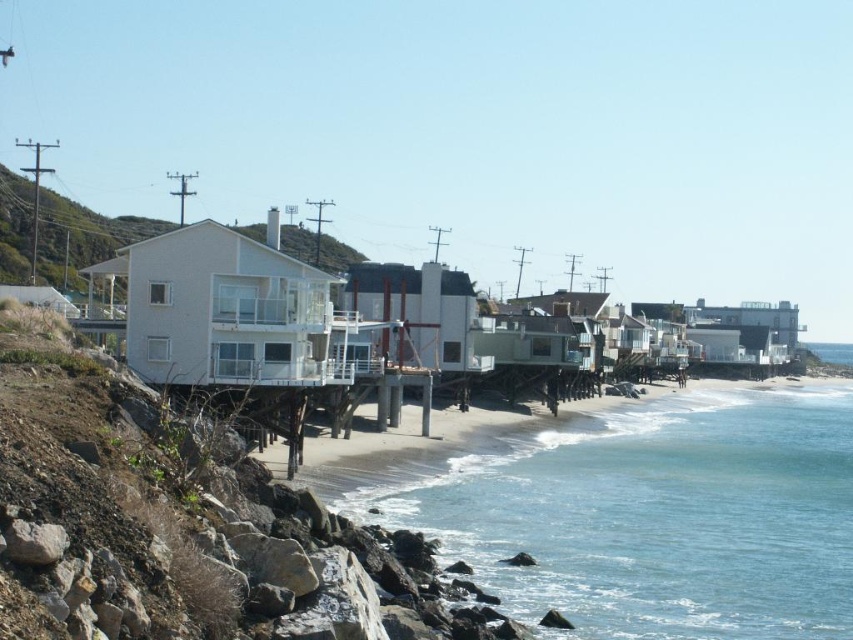
You are standing on the beach and want to take a photo of the white matte house at center without any obstructions. Is the clear blue water at lower right blocking your view of the house?

The clear blue water at lower right is in front of the white matte house at center, so it may block your view of the house depending on your position. To avoid obstruction, move to a higher elevation or position yourself where the water does not lie between you and the house.

You are standing on the beach and want to reach the clear blue water at lower right without getting your feet wet. The white matte house at center is in your way. Which direction should you walk around the house to avoid the water?

You should walk around the white matte house at center to the right side since the clear blue water at lower right is located to the right of the house.